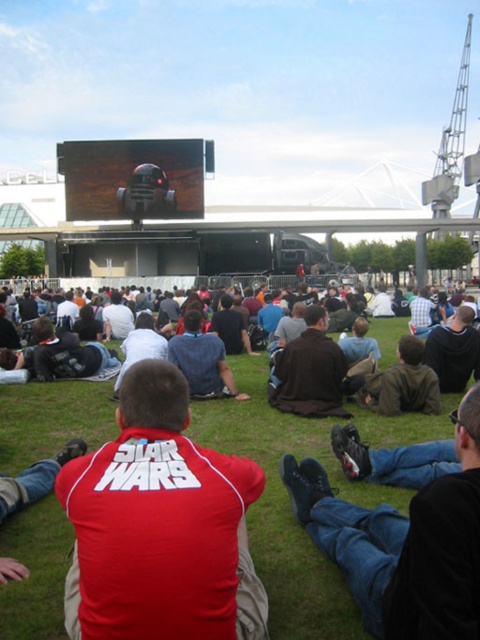
Question: Where is denim jeans at center located in relation to dark blue shirt at center in the image?

Choices:
 (A) below
 (B) above

Answer: (A)

Question: Considering the real-world distances, which object is closest to the dark blue shirt at center?

Choices:
 (A) denim jeans at center
 (B) brown leather jacket at center

Answer: (B)

Question: Observing the image, what is the correct spatial positioning of red matte shirt at center in reference to dark brown jacket at center?

Choices:
 (A) left
 (B) right

Answer: (A)

Question: Which of the following is the farthest from the observer?

Choices:
 (A) dark brown leather jacket at center
 (B) red matte shirt at center

Answer: (A)

Question: Can you confirm if dark blue shirt at center is positioned below dark brown leather jacket at upper center?

Choices:
 (A) no
 (B) yes

Answer: (A)

Question: Which object is the closest to the dark brown leather jacket at upper center?

Choices:
 (A) denim jeans at center
 (B) dark brown jacket at center
 (C) dark brown leather jacket at center

Answer: (B)